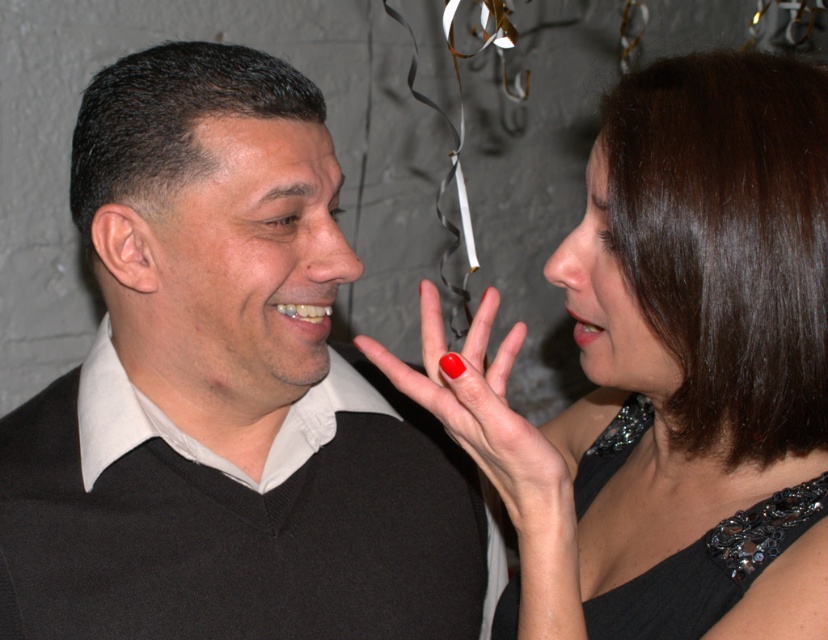
Question: Which point appears closest to the camera in this image?

Choices:
 (A) click(124, 70)
 (B) click(716, 548)

Answer: (B)

Question: Which object appears farthest from the camera in this image?

Choices:
 (A) shiny black dress at right
 (B) black matte sweater at left
 (C) shiny red nail at center
 (D) black sequined dress at center

Answer: (B)

Question: Is black matte sweater at left smaller than black sequined dress at center?

Choices:
 (A) no
 (B) yes

Answer: (A)

Question: Which of these objects is positioned closest to the black matte sweater at left?

Choices:
 (A) shiny black dress at right
 (B) shiny red nail at center
 (C) black sequined dress at center

Answer: (B)

Question: Is black matte sweater at left above shiny red nail at center?

Choices:
 (A) no
 (B) yes

Answer: (A)

Question: Can you confirm if shiny black dress at right is positioned above black sequined dress at center?

Choices:
 (A) no
 (B) yes

Answer: (B)